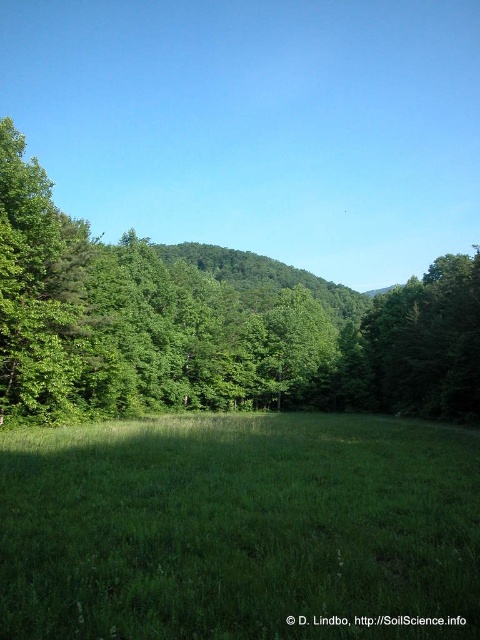
You are standing at the origin point of the coordinate system. You want to walk to the green grassy field at center. Which direction should you head towards?

The green grassy field at center is located at coordinate point 0.827 on the x axis and 0.498 on the y axis. Since you are at the origin point, you should move towards the positive x and positive y directions to reach it.

Based on the scene description, where is the point at coordinates (239,529) located?

The point at coordinates (239,529) is located on the green grassy field at center.